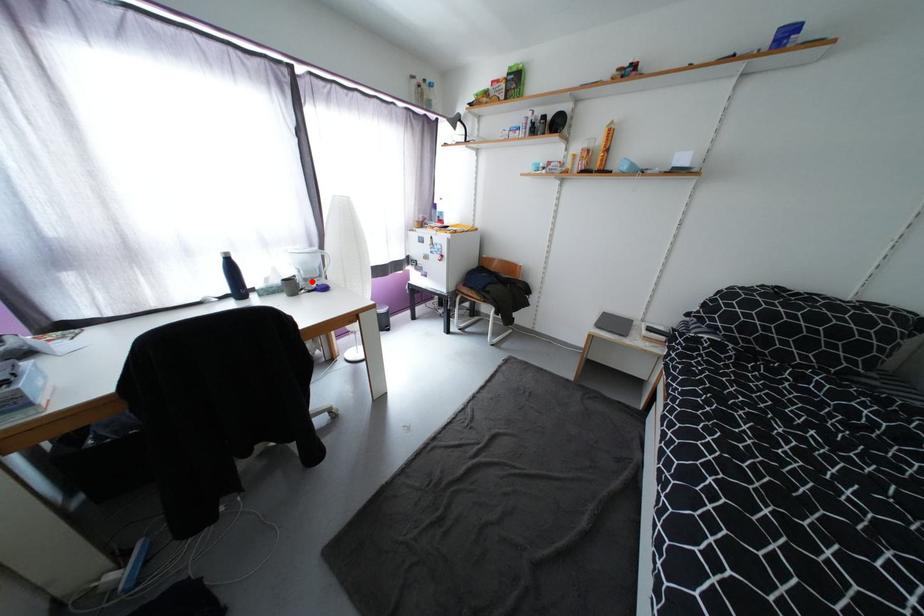
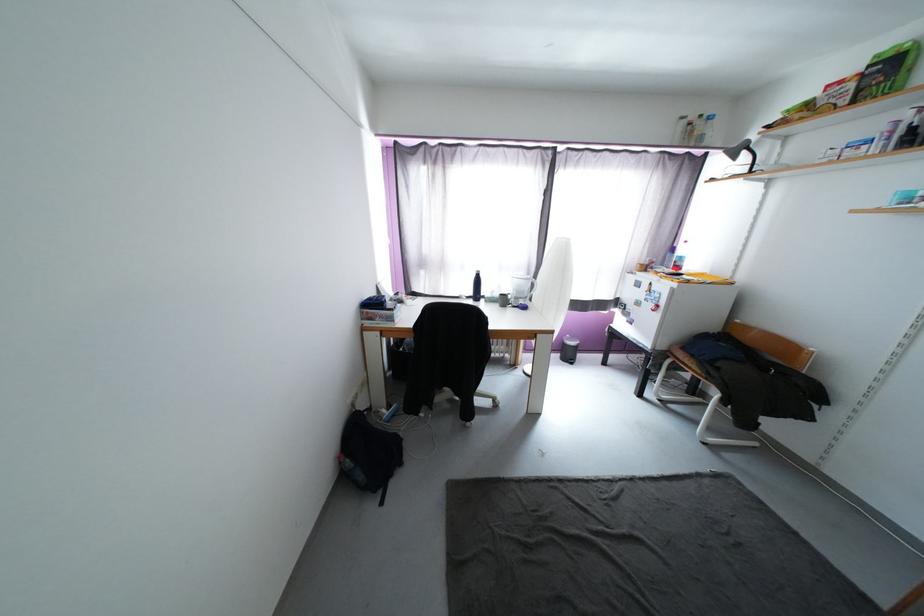
Find the pixel in the second image that matches the highlighted location in the first image.

(521, 300)